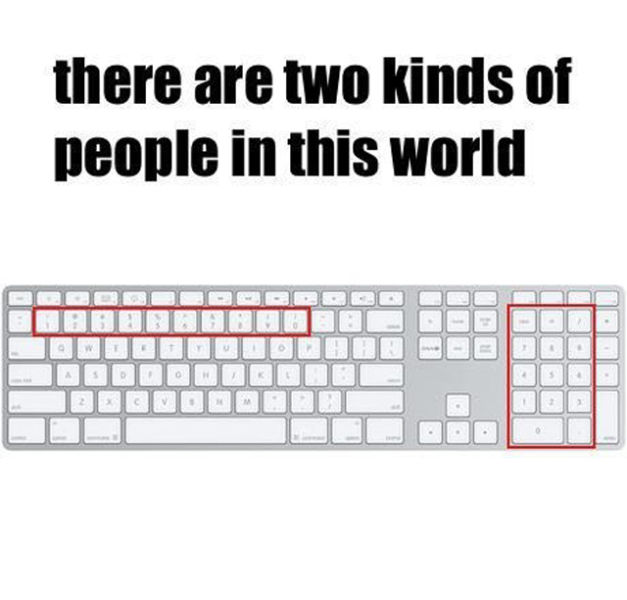
Where is `short vertical edges of keyboard`? The image size is (627, 600). short vertical edges of keyboard is located at coordinates (3, 315), (624, 338).